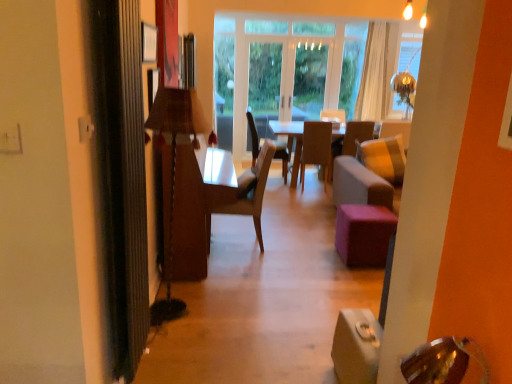
Identify the location of free space on the front side of light brown wood chair at center, positioned as the first chair in left-to-right order. (257, 262).